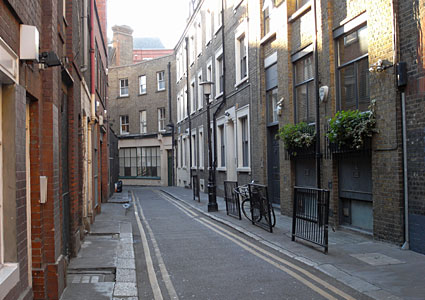
In order to click on green plants on right side wall in this screenshot , I will do click(x=290, y=132), click(x=351, y=126).